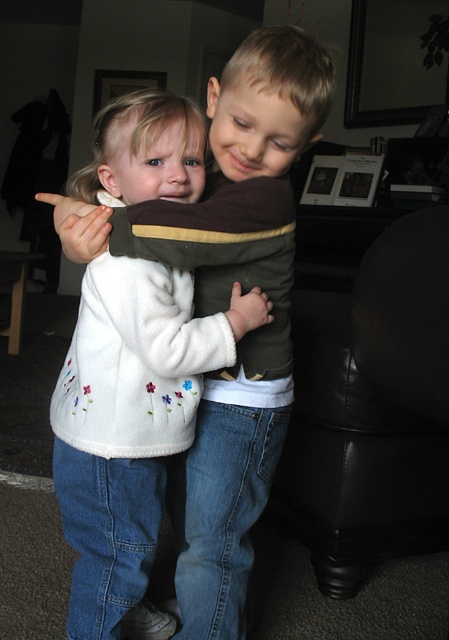
You are a delivery robot with a package that measures 20 inches in length. You need to move the package from the white fleece sweater at center to the black leather armchair at right. Can you fit the package between these two items without tilting it?

The distance between the white fleece sweater at center and the black leather armchair at right is 21.07 inches, so the package measuring 20 inches can fit through the space as it is slightly shorter than the available distance.

You are a furniture designer evaluating the spatial compatibility of the white fleece sweater at center and the black leather armchair at right in the living room. Based on their sizes, can the sweater be placed on the armchair without looking awkward?

The white fleece sweater at center is much taller than the black leather armchair at right, so placing the sweater on the armchair would look awkward due to the size mismatch.

You are a photographer standing at point (79, 348). You want to take a picture of the two children so that they both are in focus. Given that your camera has a depth of field that can cover 40 inches, will you be able to capture both children in focus without adjusting your position?

The two children are 38.79 inches apart, which is within the camera depth of field of 40 inches. Therefore, the photographer can capture both children in focus without moving.